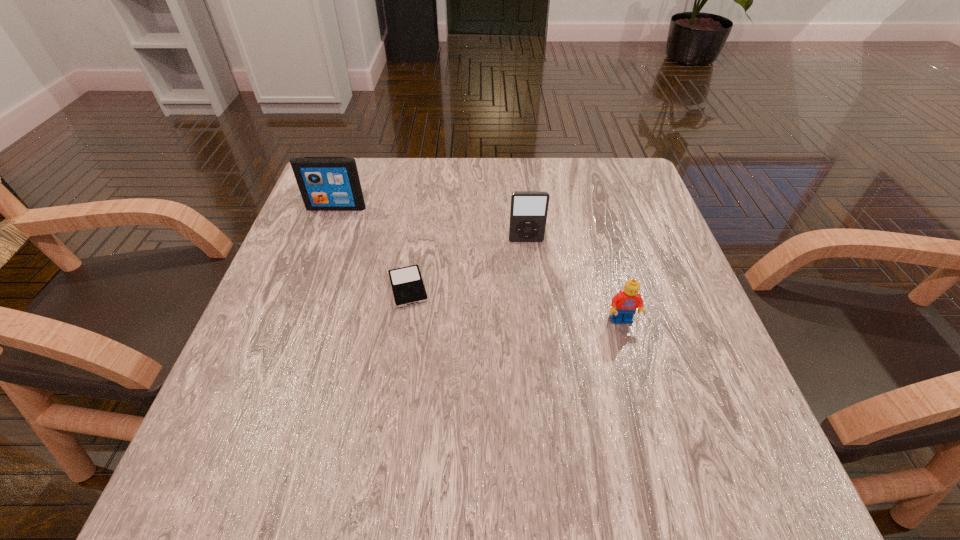
The image size is (960, 540). I want to click on the leftmost object, so click(326, 183).

Where is `the farthest object`? The image size is (960, 540). the farthest object is located at coordinates (326, 183).

Image resolution: width=960 pixels, height=540 pixels. In order to click on the rightmost iPod in this screenshot , I will do `click(528, 209)`.

Identify the location of the third nearest object. (528, 209).

I want to click on Lego, so click(x=624, y=304).

At what (x,y) coordinates should I click in order to perform the action: click on the third tallest object. Please return your answer as a coordinate pair (x, y). Image resolution: width=960 pixels, height=540 pixels. Looking at the image, I should click on (624, 304).

At what (x,y) coordinates should I click in order to perform the action: click on the second iPod from right to left. Please return your answer as a coordinate pair (x, y). Looking at the image, I should click on (408, 288).

This screenshot has height=540, width=960. What are the coordinates of `the third object from right to left` in the screenshot? It's located at 408,288.

Locate an element on the screen. The height and width of the screenshot is (540, 960). vacant space situated 0.330m on the front screen of the farthest iPod is located at coordinates (294, 321).

At what (x,y) coordinates should I click in order to perform the action: click on free location located on the front-facing side of the rightmost iPod. Please return your answer as a coordinate pair (x, y). The height and width of the screenshot is (540, 960). Looking at the image, I should click on (533, 301).